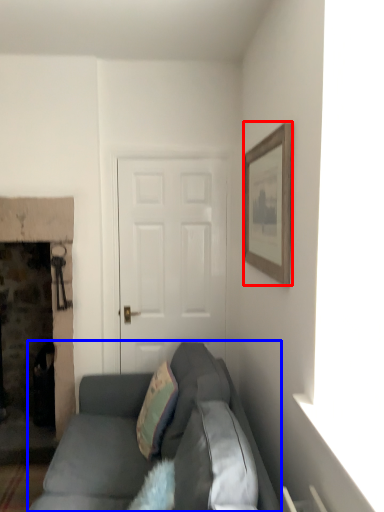
Question: Which point is further to the camera, picture frame (highlighted by a red box) or studio couch (highlighted by a blue box)?

Choices:
 (A) picture frame
 (B) studio couch

Answer: (A)